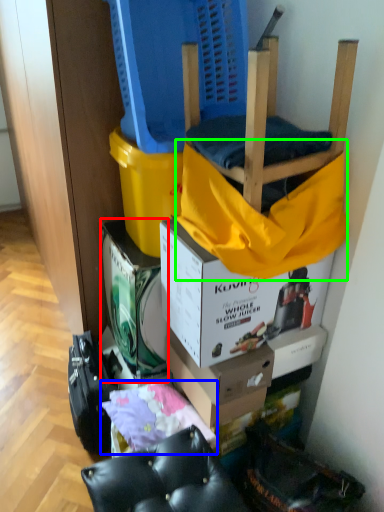
Question: Which is nearer to the box (highlighted by a red box)? material (highlighted by a blue box) or blanket (highlighted by a green box).

Choices:
 (A) material
 (B) blanket

Answer: (A)